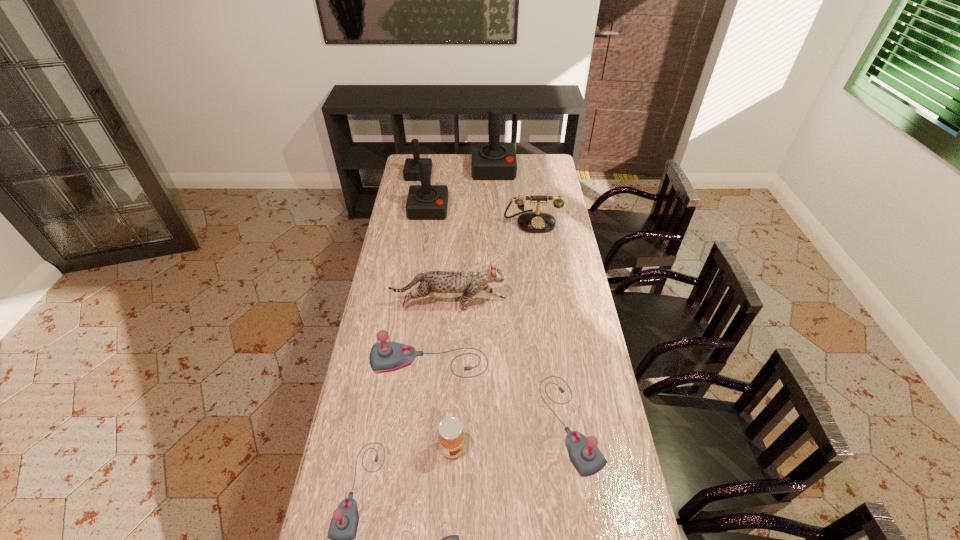
I want to click on telephone located at the right edge, so click(x=533, y=222).

The width and height of the screenshot is (960, 540). I want to click on joystick positioned at the right edge, so click(x=587, y=459).

Locate an element on the screen. object that is at the far left corner is located at coordinates (411, 167).

In the image, there is a desktop. Find the location of `vacant space at the far edge`. vacant space at the far edge is located at coordinates (458, 161).

Locate an element on the screen. The width and height of the screenshot is (960, 540). free space at the left edge of the desktop is located at coordinates (401, 220).

In the image, there is a desktop. Find the location of `blank space at the right edge`. blank space at the right edge is located at coordinates (561, 292).

The image size is (960, 540). I want to click on free spot between the honey and the fifth shortest joystick, so click(x=436, y=312).

The height and width of the screenshot is (540, 960). What are the coordinates of `vacant area that lies between the smallest red joystick and the tallest object` in the screenshot? It's located at (456, 172).

In order to click on vacant space that's between the second tallest object and the orange honey in this screenshot , I will do `click(441, 329)`.

Where is `vacant point located between the smallest red joystick and the cat`? vacant point located between the smallest red joystick and the cat is located at coordinates (434, 240).